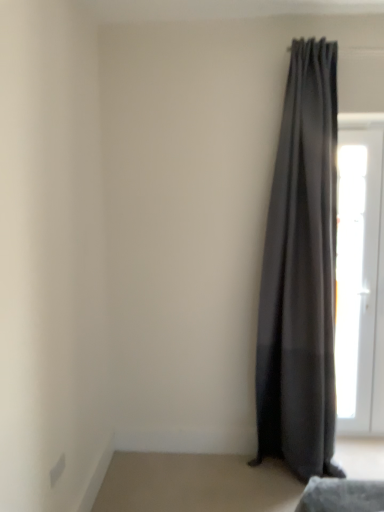
Question: Considering the relative sizes of white glossy door at right and dark gray sheer curtain at right in the image provided, is white glossy door at right bigger than dark gray sheer curtain at right?

Choices:
 (A) yes
 (B) no

Answer: (B)

Question: From a real-world perspective, is white glossy door at right physically below dark gray sheer curtain at right?

Choices:
 (A) yes
 (B) no

Answer: (A)

Question: Would you say white glossy door at right is a long distance from dark gray sheer curtain at right?

Choices:
 (A) yes
 (B) no

Answer: (B)

Question: Is white glossy door at right taller than dark gray sheer curtain at right?

Choices:
 (A) yes
 (B) no

Answer: (B)

Question: Is white glossy door at right shorter than dark gray sheer curtain at right?

Choices:
 (A) yes
 (B) no

Answer: (A)

Question: Is white glossy door at right at the right side of dark gray sheer curtain at right?

Choices:
 (A) no
 (B) yes

Answer: (B)

Question: Is dark gray sheer curtain at right positioned behind white glossy door at right?

Choices:
 (A) yes
 (B) no

Answer: (B)

Question: Is dark gray sheer curtain at right outside of white glossy door at right?

Choices:
 (A) yes
 (B) no

Answer: (A)

Question: Is dark gray sheer curtain at right positioned far away from white glossy door at right?

Choices:
 (A) yes
 (B) no

Answer: (B)

Question: Can white glossy door at right be found inside dark gray sheer curtain at right?

Choices:
 (A) yes
 (B) no

Answer: (B)

Question: Can you confirm if dark gray sheer curtain at right is smaller than white glossy door at right?

Choices:
 (A) yes
 (B) no

Answer: (B)

Question: Can you confirm if dark gray sheer curtain at right is positioned to the right of white glossy door at right?

Choices:
 (A) yes
 (B) no

Answer: (B)

Question: From a real-world perspective, is white glossy door at right above or below dark gray sheer curtain at right?

Choices:
 (A) above
 (B) below

Answer: (B)